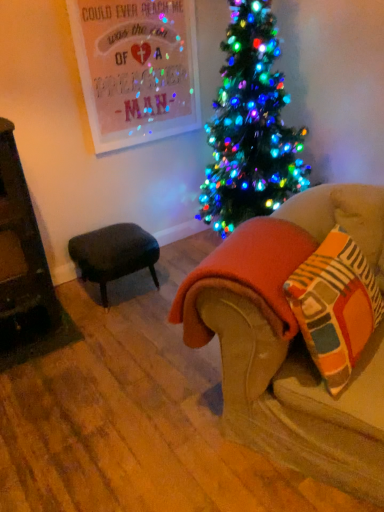
Question: Is orange fleece blanket at lower right wider or thinner than striped cotton throw pillow at lower right?

Choices:
 (A) thin
 (B) wide

Answer: (B)

Question: In the image, is orange fleece blanket at lower right positioned in front of or behind striped cotton throw pillow at lower right?

Choices:
 (A) front
 (B) behind

Answer: (B)

Question: Which object is the farthest from the velvet beige couch at lower right?

Choices:
 (A) dark gray fabric stool at lower left
 (B) striped cotton throw pillow at lower right
 (C) orange fleece blanket at lower right

Answer: (A)

Question: Which is nearer to the striped cotton throw pillow at lower right?

Choices:
 (A) orange fleece blanket at lower right
 (B) velvet beige couch at lower right
 (C) dark gray fabric stool at lower left

Answer: (B)